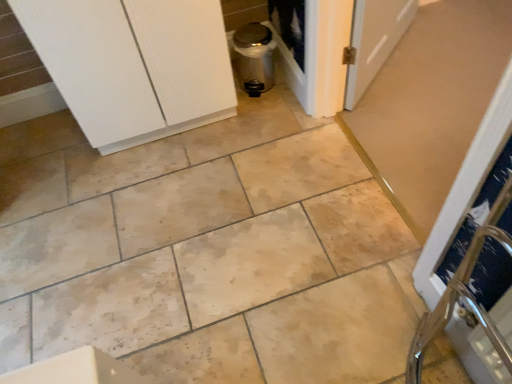
Find the location of `free space in front of white textured cabinet at upper left`. free space in front of white textured cabinet at upper left is located at coordinates (166, 197).